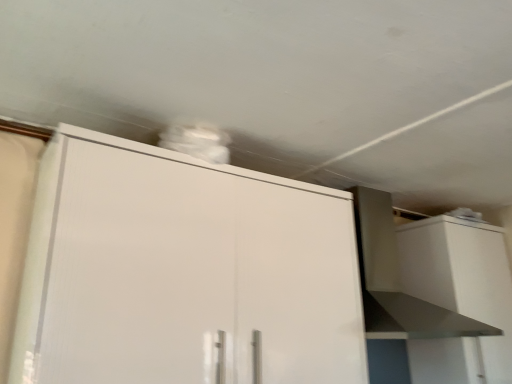
Question: Considering the relative sizes of white matte vent at upper right and white matte cabinet at right, placed as the 1th cabinetry when sorted from back to front, in the image provided, is white matte vent at upper right bigger than white matte cabinet at right, placed as the 1th cabinetry when sorted from back to front,?

Choices:
 (A) no
 (B) yes

Answer: (B)

Question: Is white matte cabinet at right, which is the 2th cabinetry from front to back, completely or partially inside white matte vent at upper right?

Choices:
 (A) yes
 (B) no

Answer: (B)

Question: From a real-world perspective, is white matte vent at upper right physically below white matte cabinet at right, placed as the 1th cabinetry when sorted from back to front?

Choices:
 (A) no
 (B) yes

Answer: (A)

Question: From a real-world perspective, is white matte vent at upper right over white matte cabinet at right, which is the 2th cabinetry from front to back?

Choices:
 (A) yes
 (B) no

Answer: (A)

Question: Does white matte vent at upper right have a greater width compared to white matte cabinet at right, which is the 2th cabinetry from front to back?

Choices:
 (A) yes
 (B) no

Answer: (A)

Question: In the image, is white matte cabinet at right, the second cabinetry in the left-to-right sequence, on the left side or the right side of white matte vent at upper right?

Choices:
 (A) right
 (B) left

Answer: (A)

Question: Considering the positions of white matte cabinet at right, which ranks as the first cabinetry in right-to-left order, and white matte vent at upper right in the image, is white matte cabinet at right, which ranks as the first cabinetry in right-to-left order, wider or thinner than white matte vent at upper right?

Choices:
 (A) wide
 (B) thin

Answer: (B)

Question: Is white matte cabinet at right, placed as the 1th cabinetry when sorted from back to front, taller or shorter than white matte vent at upper right?

Choices:
 (A) short
 (B) tall

Answer: (B)

Question: From the image's perspective, relative to white matte vent at upper right, is white matte cabinet at right, placed as the 1th cabinetry when sorted from back to front, above or below?

Choices:
 (A) above
 (B) below

Answer: (B)

Question: From a real-world perspective, relative to white glossy cabinet at upper center, marked as the second cabinetry in a back-to-front arrangement, is white matte cabinet at right, the second cabinetry in the left-to-right sequence, vertically above or below?

Choices:
 (A) below
 (B) above

Answer: (A)

Question: Considering the positions of point (480, 274) and point (160, 200), is point (480, 274) closer or farther from the camera than point (160, 200)?

Choices:
 (A) farther
 (B) closer

Answer: (A)

Question: Which is correct: white matte cabinet at right, the second cabinetry in the left-to-right sequence, is inside white glossy cabinet at upper center, positioned as the first cabinetry in left-to-right order, or outside of it?

Choices:
 (A) outside
 (B) inside

Answer: (A)

Question: Looking at their shapes, would you say white matte cabinet at right, which is the 2th cabinetry from front to back, is wider or thinner than white glossy cabinet at upper center, arranged as the second cabinetry when viewed from the right?

Choices:
 (A) wide
 (B) thin

Answer: (B)

Question: Based on their sizes in the image, would you say white glossy cabinet at upper center, which appears as the 1th cabinetry when viewed from the front, is bigger or smaller than white matte cabinet at right, placed as the 1th cabinetry when sorted from back to front?

Choices:
 (A) big
 (B) small

Answer: (A)

Question: From a real-world perspective, is white glossy cabinet at upper center, which appears as the 1th cabinetry when viewed from the front, above or below white matte cabinet at right, placed as the 1th cabinetry when sorted from back to front?

Choices:
 (A) above
 (B) below

Answer: (A)